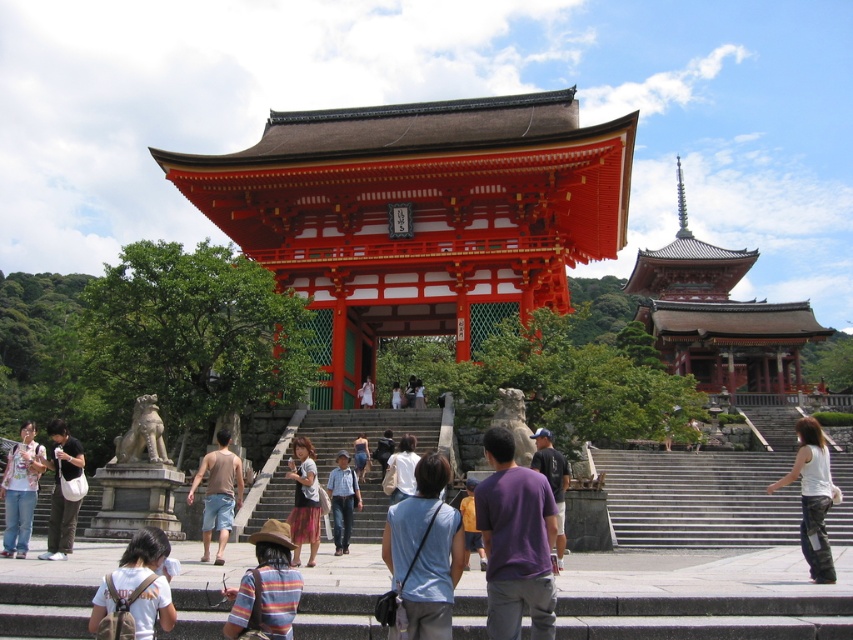
Question: Does floral t-shirt at center have a greater width compared to white fabric dress at center?

Choices:
 (A) no
 (B) yes

Answer: (B)

Question: Among these objects, which one is farthest from the camera?

Choices:
 (A) white marble stairs at center
 (B) white cotton tank top at lower right

Answer: (A)

Question: Does smooth stone stairs at center come in front of light blue fabric shirt at center?

Choices:
 (A) yes
 (B) no

Answer: (B)

Question: Which point is closer to the camera?

Choices:
 (A) (154, 554)
 (B) (335, 460)
 (C) (65, 557)

Answer: (A)

Question: Can you confirm if white cotton tank top at lower right is positioned above denim jeans at center?

Choices:
 (A) yes
 (B) no

Answer: (B)

Question: Which point is farther to the camera?

Choices:
 (A) (131, 548)
 (B) (316, 481)
 (C) (396, 458)
 (D) (363, 394)

Answer: (D)